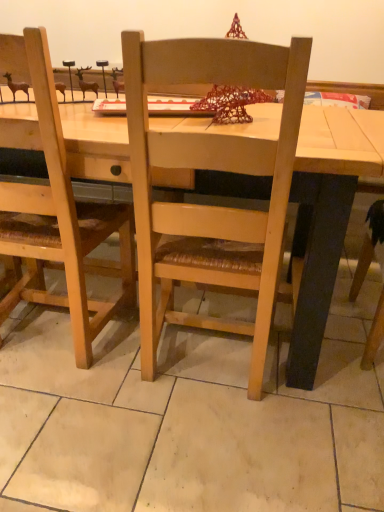
Question: Does light wood table at center contain natural wood chair at center?

Choices:
 (A) yes
 (B) no

Answer: (A)

Question: Is light wood table at center taller than natural wood chair at center?

Choices:
 (A) yes
 (B) no

Answer: (B)

Question: From a real-world perspective, is light wood table at center under natural wood chair at center?

Choices:
 (A) yes
 (B) no

Answer: (A)

Question: Can you confirm if light wood table at center is shorter than natural wood chair at center?

Choices:
 (A) yes
 (B) no

Answer: (A)

Question: Is light wood table at center outside natural wood chair at center?

Choices:
 (A) no
 (B) yes

Answer: (B)

Question: Considering the relative sizes of light wood table at center and natural wood chair at center in the image provided, is light wood table at center wider than natural wood chair at center?

Choices:
 (A) no
 (B) yes

Answer: (B)

Question: Does natural wood chair at center have a greater width compared to light wood table at center?

Choices:
 (A) no
 (B) yes

Answer: (A)

Question: Is natural wood chair at center located outside light wood table at center?

Choices:
 (A) no
 (B) yes

Answer: (A)

Question: Does natural wood chair at center appear on the right side of light wood table at center?

Choices:
 (A) no
 (B) yes

Answer: (B)

Question: Is the position of natural wood chair at center less distant than that of light wood table at center?

Choices:
 (A) yes
 (B) no

Answer: (A)

Question: Are natural wood chair at center and light wood table at center located far from each other?

Choices:
 (A) yes
 (B) no

Answer: (B)

Question: Does natural wood chair at center have a lesser width compared to light wood table at center?

Choices:
 (A) no
 (B) yes

Answer: (B)

Question: From a real-world perspective, is light wood table at center positioned above or below natural wood chair at center?

Choices:
 (A) below
 (B) above

Answer: (A)